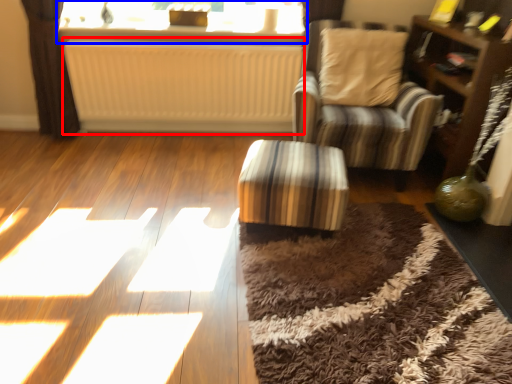
Question: Which point is further to the camera, radiator (highlighted by a red box) or window (highlighted by a blue box)?

Choices:
 (A) radiator
 (B) window

Answer: (B)